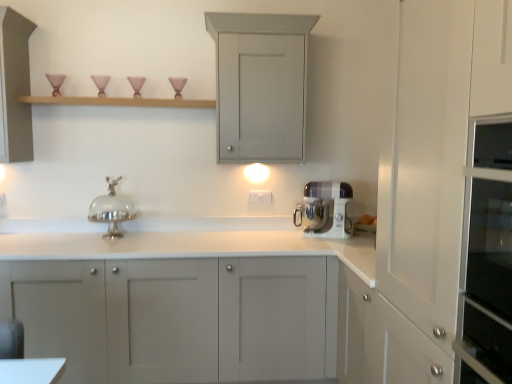
Question: From the image's perspective, does white plastic stand mixer at center appear higher than silver metallic cake stand at center?

Choices:
 (A) no
 (B) yes

Answer: (A)

Question: From a real-world perspective, is white plastic stand mixer at center below silver metallic cake stand at center?

Choices:
 (A) no
 (B) yes

Answer: (B)

Question: Considering the relative sizes of white plastic stand mixer at center and silver metallic cake stand at center in the image provided, is white plastic stand mixer at center wider than silver metallic cake stand at center?

Choices:
 (A) no
 (B) yes

Answer: (A)

Question: Is white plastic stand mixer at center oriented away from silver metallic cake stand at center?

Choices:
 (A) no
 (B) yes

Answer: (A)

Question: Is white plastic stand mixer at center smaller than silver metallic cake stand at center?

Choices:
 (A) yes
 (B) no

Answer: (A)

Question: Considering their positions, is wooden shelf at upper center located in front of or behind white plastic stand mixer at center?

Choices:
 (A) behind
 (B) front

Answer: (B)

Question: Looking at their shapes, would you say wooden shelf at upper center is wider or thinner than white plastic stand mixer at center?

Choices:
 (A) thin
 (B) wide

Answer: (B)

Question: From their relative heights in the image, would you say wooden shelf at upper center is taller or shorter than white plastic stand mixer at center?

Choices:
 (A) tall
 (B) short

Answer: (B)

Question: Does point (123, 104) appear closer or farther from the camera than point (296, 210)?

Choices:
 (A) closer
 (B) farther

Answer: (A)

Question: In the image, is matte gray cabinet at upper center, which is counted as the 1th cabinetry, starting from the top, positioned in front of or behind matte gray cabinet at left, the 2th cabinetry ordered from the bottom?

Choices:
 (A) front
 (B) behind

Answer: (B)

Question: Is matte gray cabinet at upper center, positioned as the third cabinetry in bottom-to-top order, taller or shorter than matte gray cabinet at left, which appears as the 2th cabinetry when viewed from the top?

Choices:
 (A) tall
 (B) short

Answer: (B)

Question: Is matte gray cabinet at upper center, which is counted as the 1th cabinetry, starting from the top, wider or thinner than matte gray cabinet at left, which appears as the 2th cabinetry when viewed from the top?

Choices:
 (A) wide
 (B) thin

Answer: (B)

Question: In terms of size, does matte gray cabinet at upper center, which is counted as the 1th cabinetry, starting from the top, appear bigger or smaller than matte gray cabinet at left, which appears as the 2th cabinetry when viewed from the top?

Choices:
 (A) big
 (B) small

Answer: (A)

Question: Considering the relative positions of matte gray cabinet at upper center, positioned as the third cabinetry in bottom-to-top order, and wooden shelf at upper center in the image provided, is matte gray cabinet at upper center, positioned as the third cabinetry in bottom-to-top order, to the left or to the right of wooden shelf at upper center?

Choices:
 (A) right
 (B) left

Answer: (A)

Question: From a real-world perspective, is matte gray cabinet at upper center, which is counted as the 1th cabinetry, starting from the top, positioned above or below wooden shelf at upper center?

Choices:
 (A) above
 (B) below

Answer: (A)